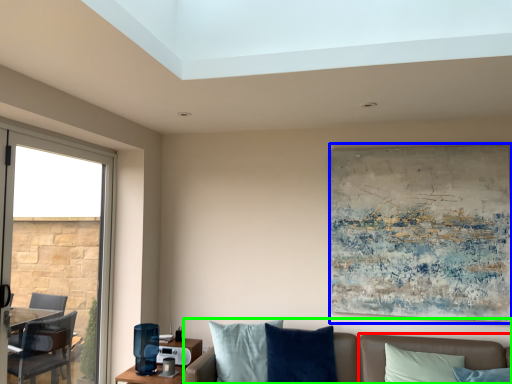
Question: Which object is positioned farthest from couch (highlighted by a red box)? Select from picture frame (highlighted by a blue box) and studio couch (highlighted by a green box).

Choices:
 (A) picture frame
 (B) studio couch

Answer: (A)